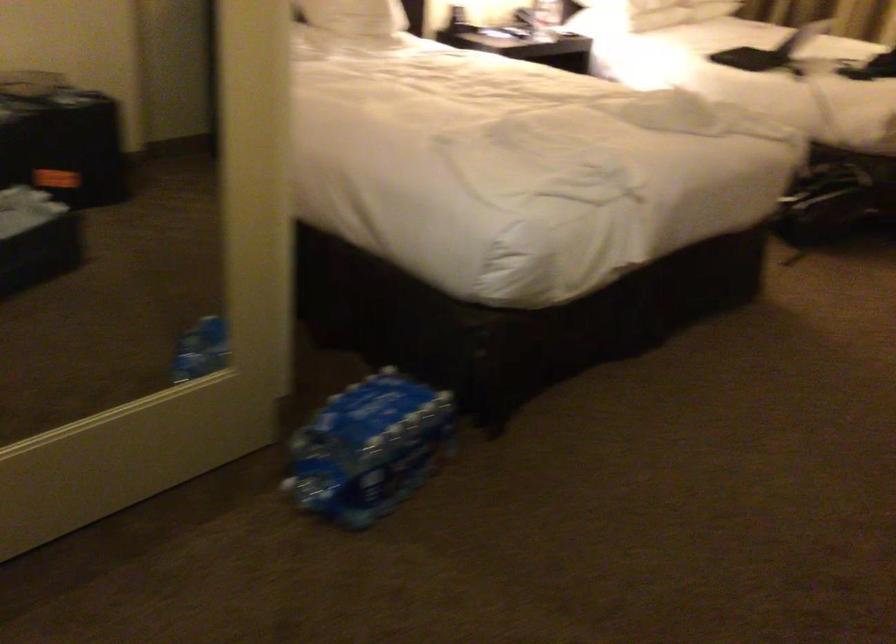
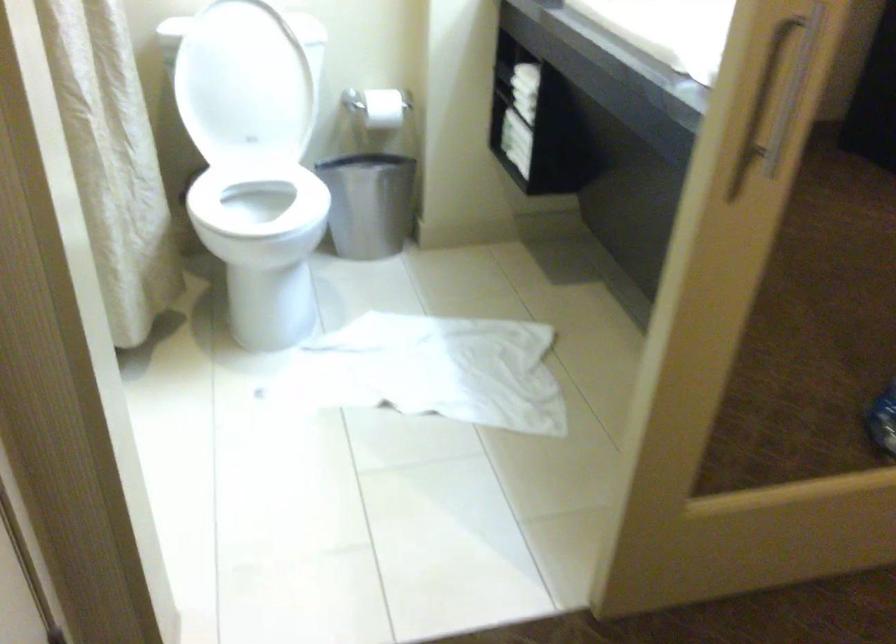
The point at (80, 397) is marked in the first image. Where is the corresponding point in the second image?

(754, 422)